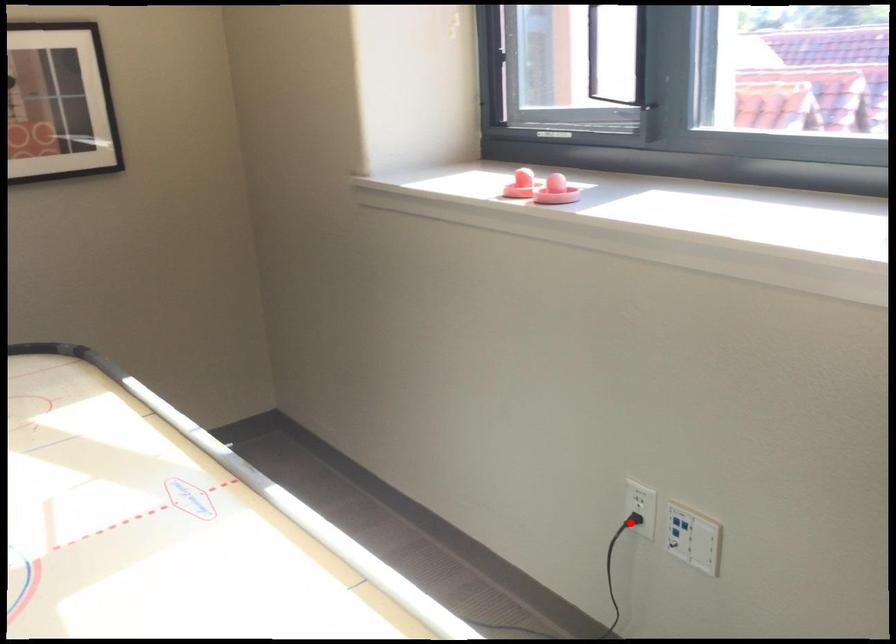
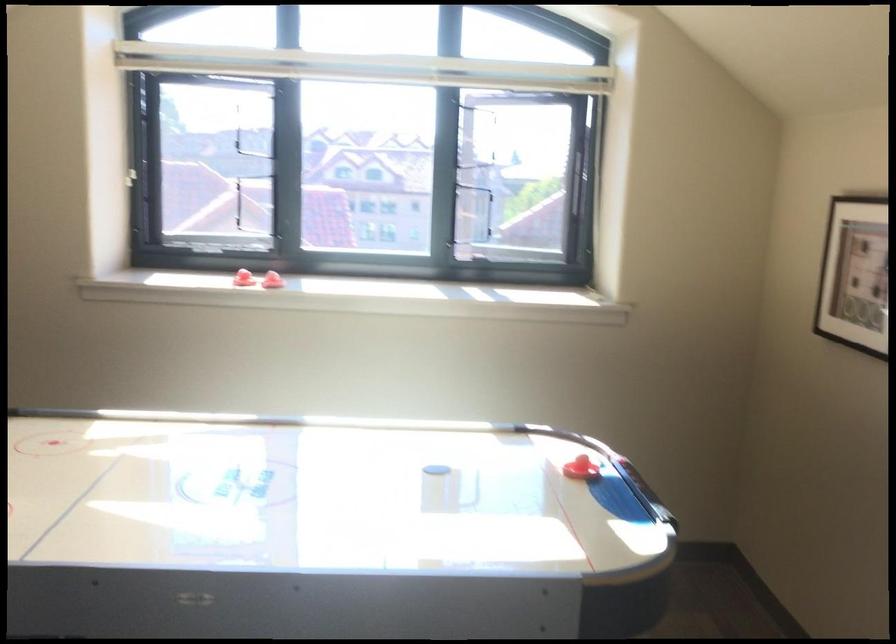
Question: I am providing you with two images of the same scene from different viewpoints. A red point is marked on the first image. At the location where the point appears in image 1, is it still visible in image 2?

Choices:
 (A) Yes
 (B) No

Answer: (B)